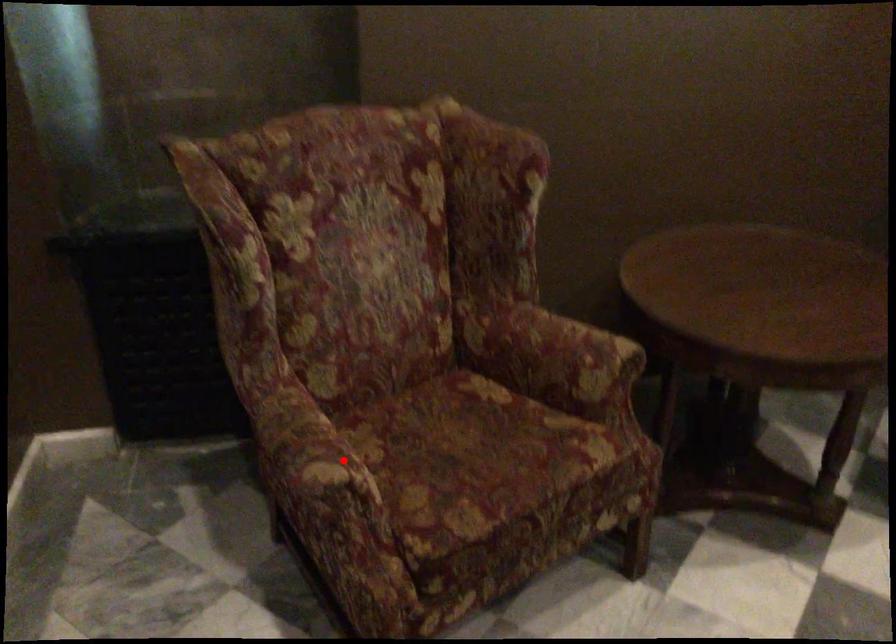
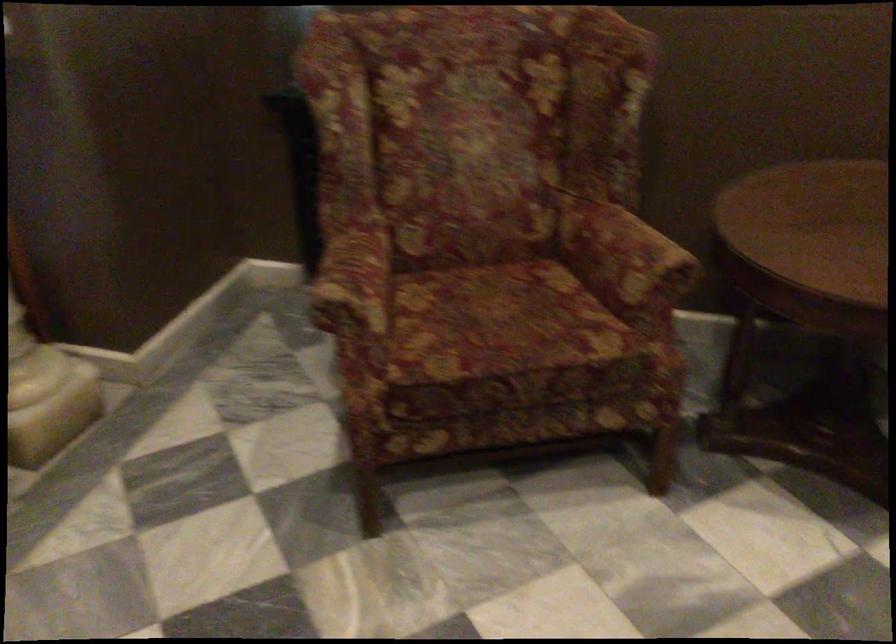
Question: I am providing you with two images of the same scene from different viewpoints. Image1 has a red point marked. In image2, the corresponding 3D location appears at what relative position? Reply with the corresponding letter.

Choices:
 (A) Closer
 (B) Farther

Answer: (B)